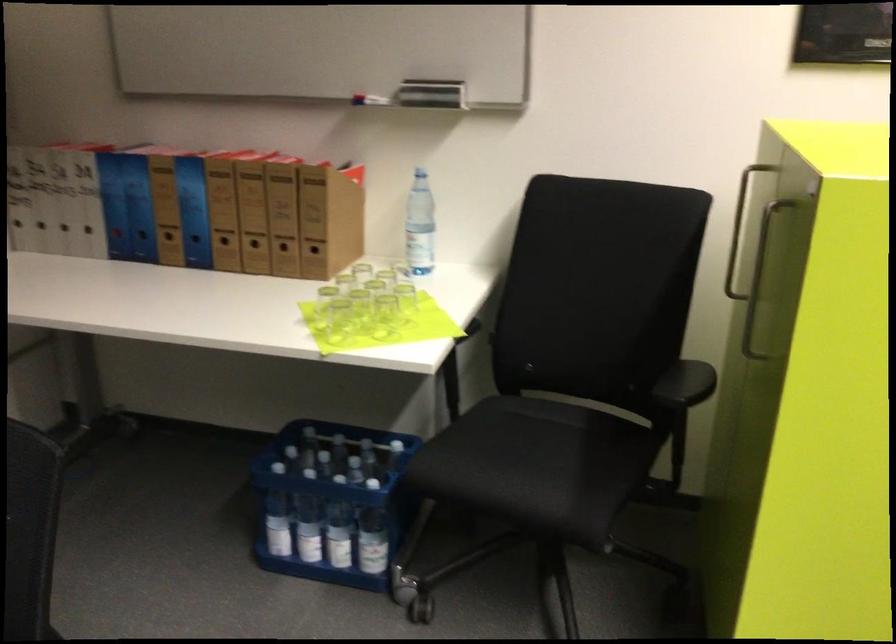
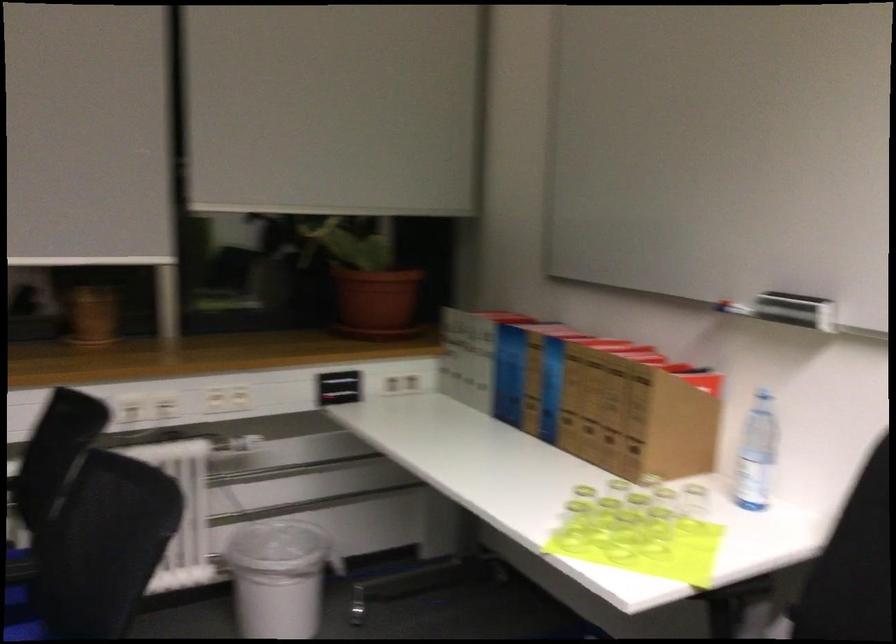
The point at (321, 326) is marked in the first image. Where is the corresponding point in the second image?

(573, 526)